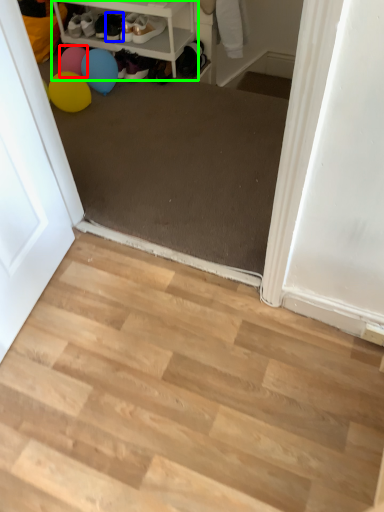
Question: Estimate the real-world distances between objects in this image. Which object is closer to balloon (highlighted by a red box), footwear (highlighted by a blue box) or shelf (highlighted by a green box)?

Choices:
 (A) footwear
 (B) shelf

Answer: (A)